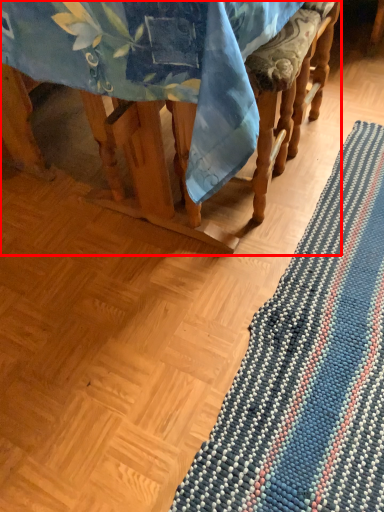
Question: Where is furniture (annotated by the red box) located in relation to mat in the image?

Choices:
 (A) left
 (B) right

Answer: (A)